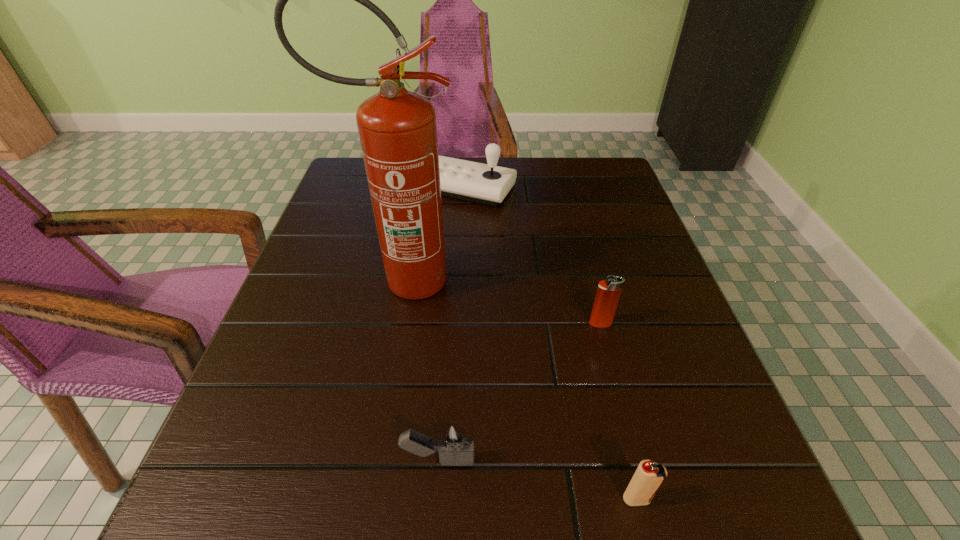
Locate which object is the third closest to the farthest igniter. Please provide its 2D coordinates. Your answer should be formatted as a tuple, i.e. [(x, y)], where the tuple contains the x and y coordinates of a point satisfying the conditions above.

[(454, 442)]

The height and width of the screenshot is (540, 960). Identify the location of the fourth closest object to the tallest object. (649, 476).

Where is `igniter that is the second closest to the nearest object`? Image resolution: width=960 pixels, height=540 pixels. igniter that is the second closest to the nearest object is located at coordinates (608, 293).

At what (x,y) coordinates should I click in order to perform the action: click on igniter that can be found as the closest to the joystick. Please return your answer as a coordinate pair (x, y). This screenshot has width=960, height=540. Looking at the image, I should click on (608, 293).

Locate an element on the screen. blank area in the image that satisfies the following two spatial constraints: 1. on the front side of the leftmost igniter; 2. on the right side of the nearest object is located at coordinates (436, 499).

This screenshot has height=540, width=960. I want to click on vacant region that satisfies the following two spatial constraints: 1. from the nozzle of the nearest object; 2. on the right side of the fire extinguisher, so click(x=361, y=499).

At what (x,y) coordinates should I click in order to perform the action: click on free space that satisfies the following two spatial constraints: 1. from the nozzle of the second farthest object; 2. on the right side of the third farthest object. Please return your answer as a coordinate pair (x, y). This screenshot has width=960, height=540. Looking at the image, I should click on (394, 323).

This screenshot has width=960, height=540. In order to click on vacant space that satisfies the following two spatial constraints: 1. from the nozzle of the nearest object; 2. on the right side of the tallest object in this screenshot , I will do `click(361, 499)`.

You are a GUI agent. You are given a task and a screenshot of the screen. Output one action in this format:
    pyautogui.click(x=<x>, y=<y>)
    Task: Click on the vacant space that satisfies the following two spatial constraints: 1. on the back side of the nearest igniter; 2. on the left side of the farthest igniter
    The image size is (960, 540).
    Given the screenshot: What is the action you would take?
    pyautogui.click(x=593, y=323)

At what (x,y) coordinates should I click in order to perform the action: click on vacant area that satisfies the following two spatial constraints: 1. from the nozzle of the third farthest object; 2. on the right side of the second farthest object. Please return your answer as a coordinate pair (x, y). The image size is (960, 540). Looking at the image, I should click on (394, 323).